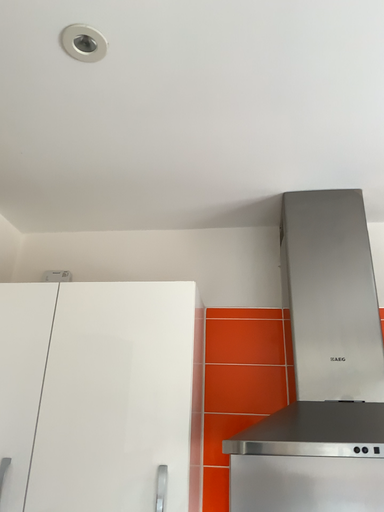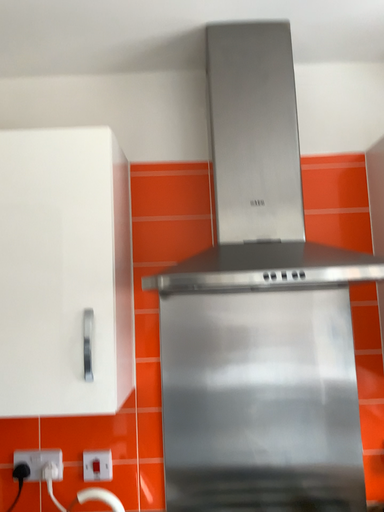
Question: Which way did the camera rotate in the video?

Choices:
 (A) rotated upward
 (B) rotated downward

Answer: (B)